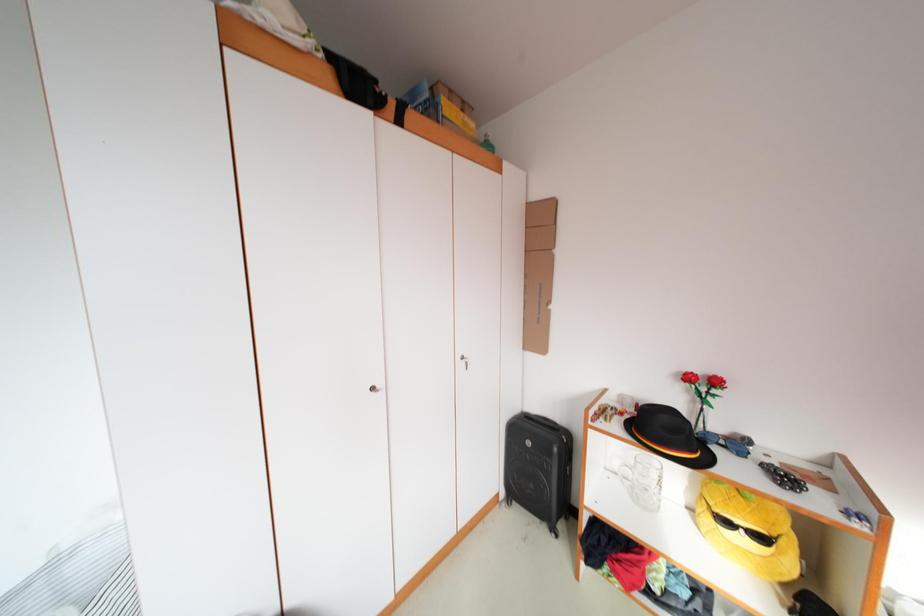
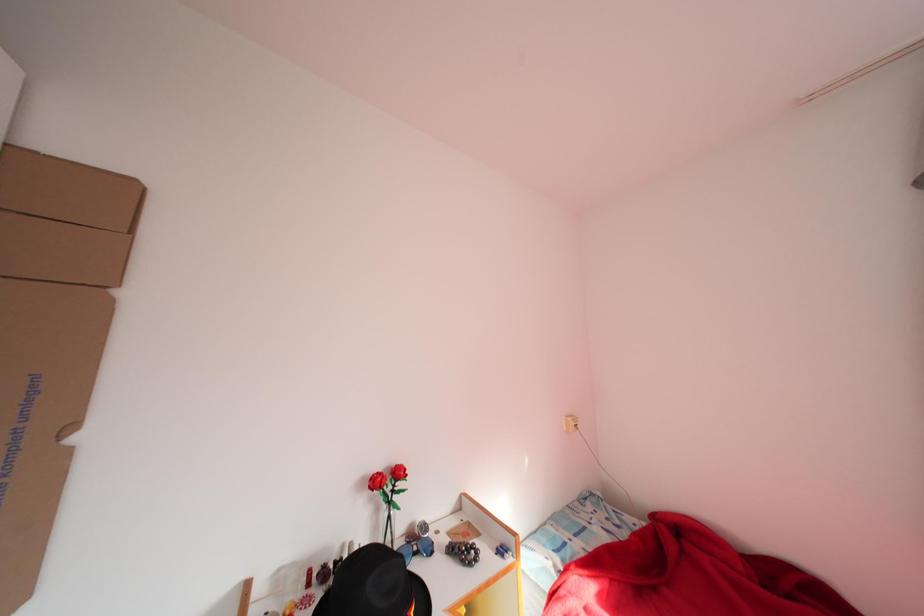
Question: The camera is either moving clockwise (left) or counter-clockwise (right) around the object. The first image is from the beginning of the video and the second image is from the end. Is the camera moving left or right when shooting the video?

Choices:
 (A) Left
 (B) Right

Answer: (A)